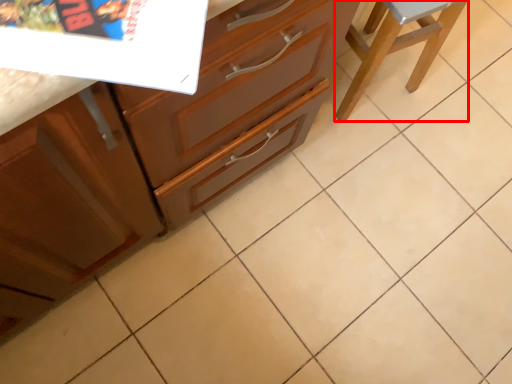
Question: From the image, what is the correct spatial relationship of furniture (annotated by the red box) in relation to cabinetry?

Choices:
 (A) left
 (B) right

Answer: (B)